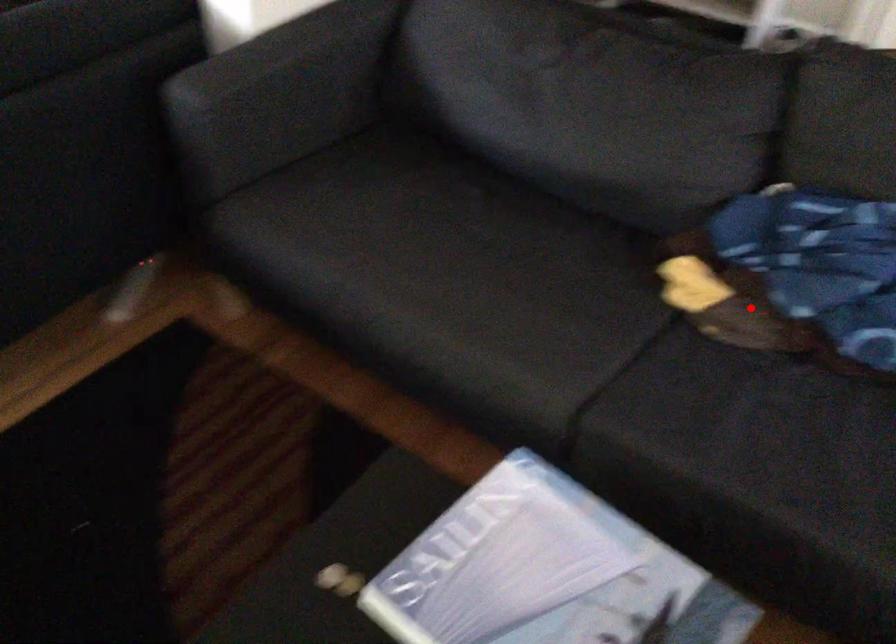
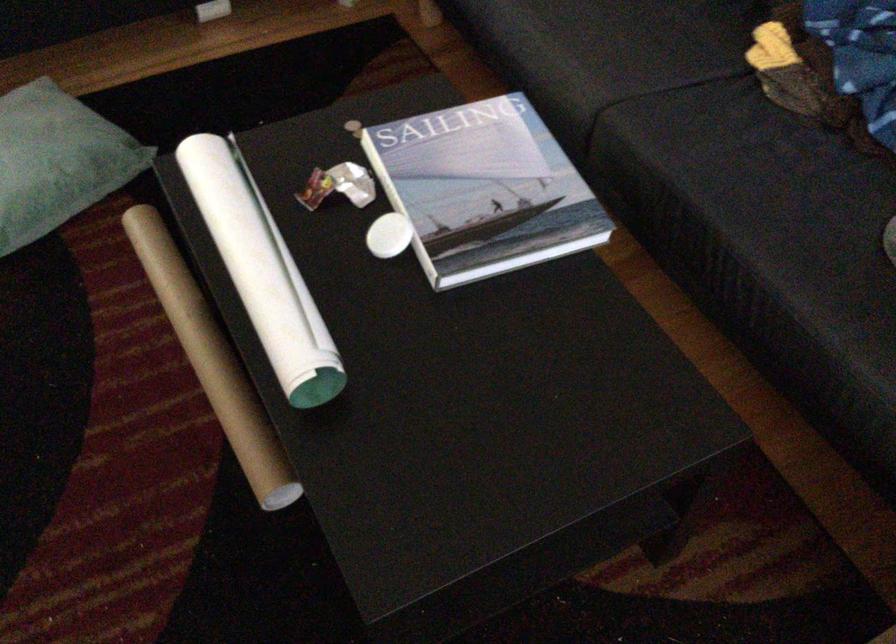
The point at the highlighted location is marked in the first image. Where is the corresponding point in the second image?

(808, 77)